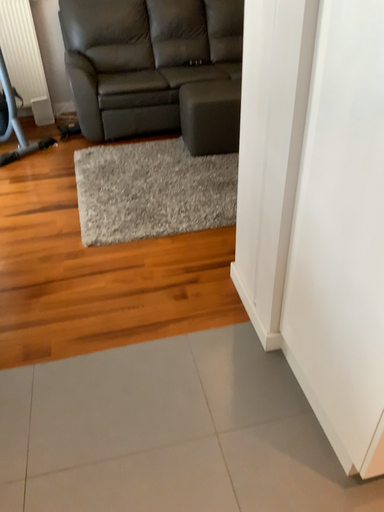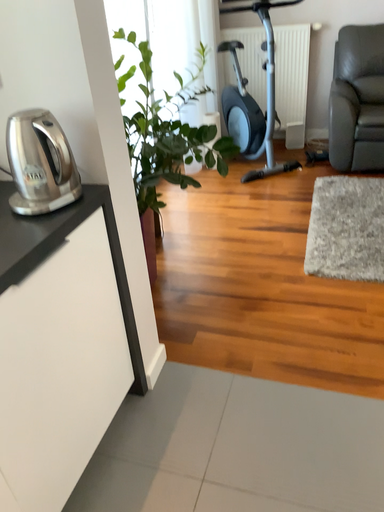
Question: Which way did the camera rotate in the video?

Choices:
 (A) rotated upward
 (B) rotated downward

Answer: (A)